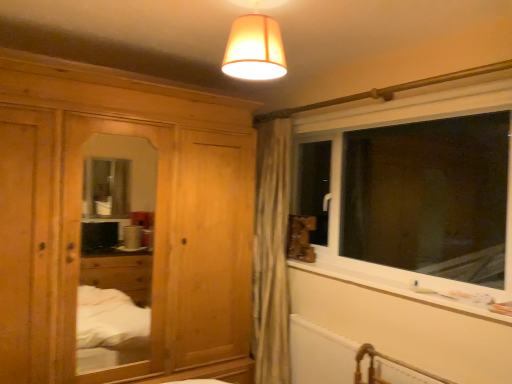
Question: Is white plastic window at right not within natural wood wardrobe at left?

Choices:
 (A) no
 (B) yes

Answer: (B)

Question: From the image's perspective, is white plastic window at right below natural wood wardrobe at left?

Choices:
 (A) yes
 (B) no

Answer: (B)

Question: Is white plastic window at right to the left of natural wood wardrobe at left from the viewer's perspective?

Choices:
 (A) yes
 (B) no

Answer: (B)

Question: Is white plastic window at right shorter than natural wood wardrobe at left?

Choices:
 (A) no
 (B) yes

Answer: (B)

Question: Is natural wood wardrobe at left surrounded by white plastic window at right?

Choices:
 (A) yes
 (B) no

Answer: (B)

Question: From the image's perspective, is matte orange fabric lampshade at upper center located above or below natural wood wardrobe at left?

Choices:
 (A) below
 (B) above

Answer: (B)

Question: Would you say matte orange fabric lampshade at upper center is inside or outside natural wood wardrobe at left?

Choices:
 (A) inside
 (B) outside

Answer: (B)

Question: Is point (253, 11) closer or farther from the camera than point (0, 271)?

Choices:
 (A) closer
 (B) farther

Answer: (A)

Question: In the image, is matte orange fabric lampshade at upper center positioned in front of or behind natural wood wardrobe at left?

Choices:
 (A) front
 (B) behind

Answer: (A)

Question: From the image's perspective, is matte orange fabric lampshade at upper center positioned above or below white plastic window sill at lower right?

Choices:
 (A) below
 (B) above

Answer: (B)

Question: Is matte orange fabric lampshade at upper center to the left or to the right of white plastic window sill at lower right in the image?

Choices:
 (A) left
 (B) right

Answer: (A)

Question: Considering the positions of matte orange fabric lampshade at upper center and white plastic window sill at lower right in the image, is matte orange fabric lampshade at upper center wider or thinner than white plastic window sill at lower right?

Choices:
 (A) thin
 (B) wide

Answer: (B)

Question: Do you think matte orange fabric lampshade at upper center is within white plastic window sill at lower right, or outside of it?

Choices:
 (A) inside
 (B) outside

Answer: (B)

Question: Is matte orange fabric lampshade at upper center wider or thinner than white plastic window at right?

Choices:
 (A) wide
 (B) thin

Answer: (A)

Question: Considering the positions of matte orange fabric lampshade at upper center and white plastic window at right in the image, is matte orange fabric lampshade at upper center taller or shorter than white plastic window at right?

Choices:
 (A) tall
 (B) short

Answer: (B)